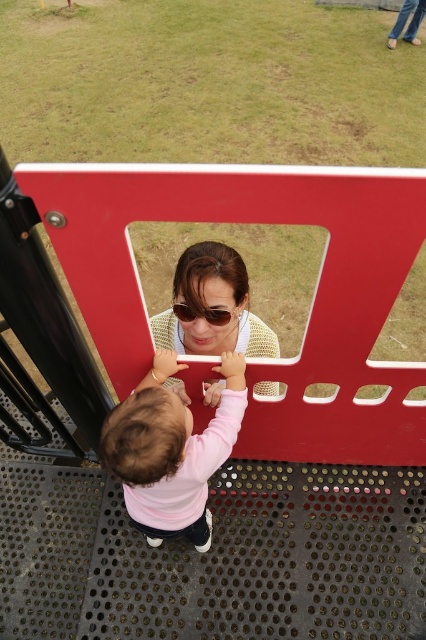
Question: Can you confirm if pink fabric toddler at center is smaller than sunglasses at center?

Choices:
 (A) no
 (B) yes

Answer: (A)

Question: Considering the relative positions of pink fabric toddler at center and sunglasses at center in the image provided, where is pink fabric toddler at center located with respect to sunglasses at center?

Choices:
 (A) below
 (B) above

Answer: (A)

Question: Which point is farther from the camera taking this photo?

Choices:
 (A) (157, 451)
 (B) (201, 308)

Answer: (B)

Question: Among these points, which one is farthest from the camera?

Choices:
 (A) (186, 307)
 (B) (115, 472)

Answer: (A)

Question: Is pink fabric toddler at center above sunglasses at center?

Choices:
 (A) no
 (B) yes

Answer: (A)